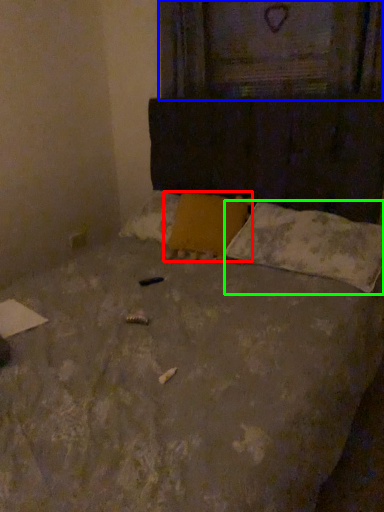
Question: Which object is positioned closest to pillow (highlighted by a red box)? Select from window frame (highlighted by a blue box) and pillow (highlighted by a green box).

Choices:
 (A) window frame
 (B) pillow

Answer: (B)